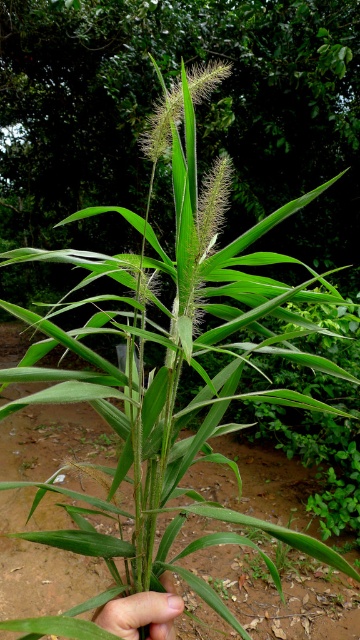
Question: Which point appears closest to the camera in this image?

Choices:
 (A) (214, 102)
 (B) (140, 604)

Answer: (B)

Question: Does green leafy plant at center have a lesser width compared to skinny green leaf at center?

Choices:
 (A) yes
 (B) no

Answer: (B)

Question: Does green leafy plant at center have a greater width compared to skinny green leaf at center?

Choices:
 (A) yes
 (B) no

Answer: (A)

Question: Considering the real-world distances, which object is farthest from the green leafy plant at center?

Choices:
 (A) skinny green leaf at center
 (B) brown soil at center

Answer: (B)

Question: Which object is positioned closest to the skinny green leaf at center?

Choices:
 (A) brown soil at center
 (B) green leafy plant at center

Answer: (A)

Question: Is green leafy plant at center closer to camera compared to skinny green leaf at center?

Choices:
 (A) yes
 (B) no

Answer: (B)